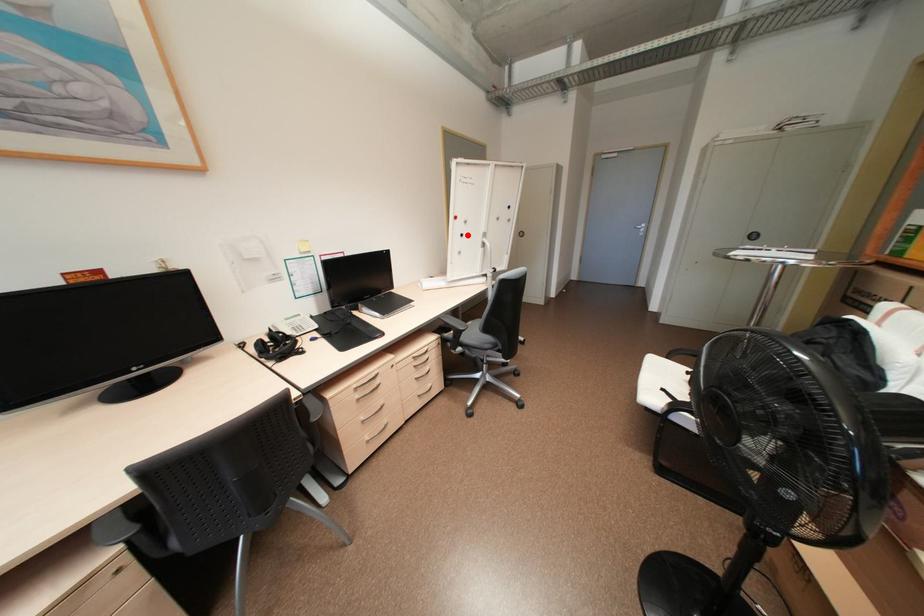
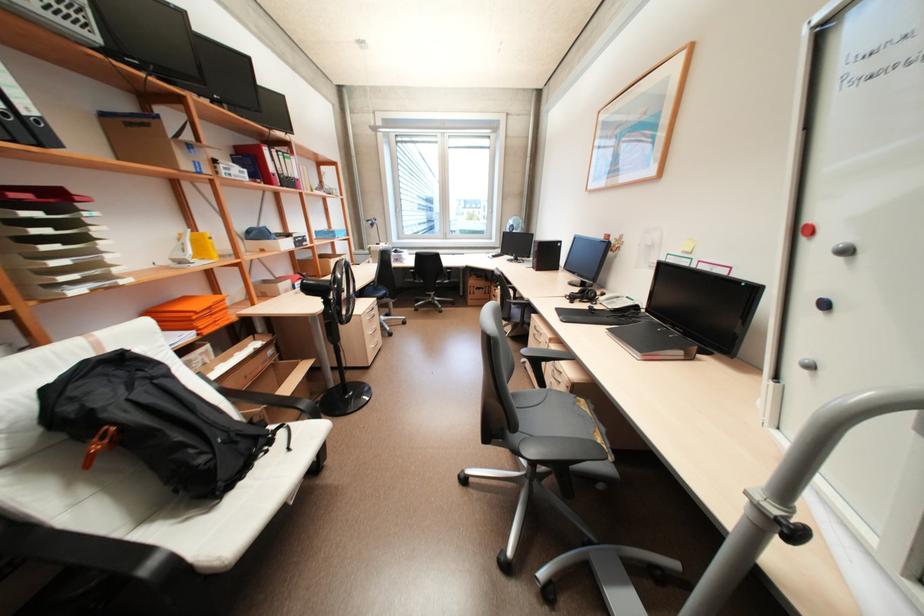
Question: I am providing you with two images of the same scene from different viewpoints. Image1 has a red point marked. In image2, the corresponding 3D location appears at what relative position? Reply with the corresponding letter.

Choices:
 (A) Closer
 (B) Farther

Answer: (B)